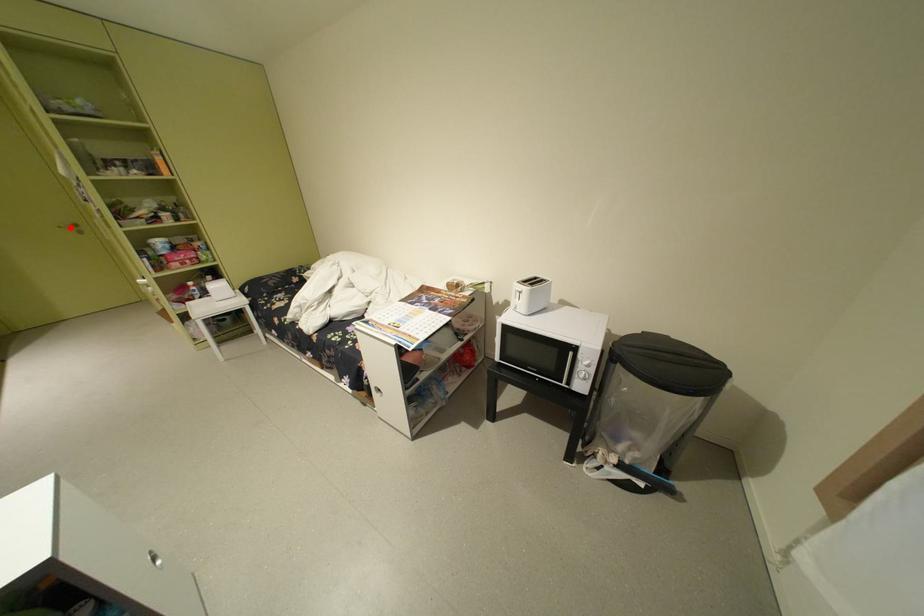
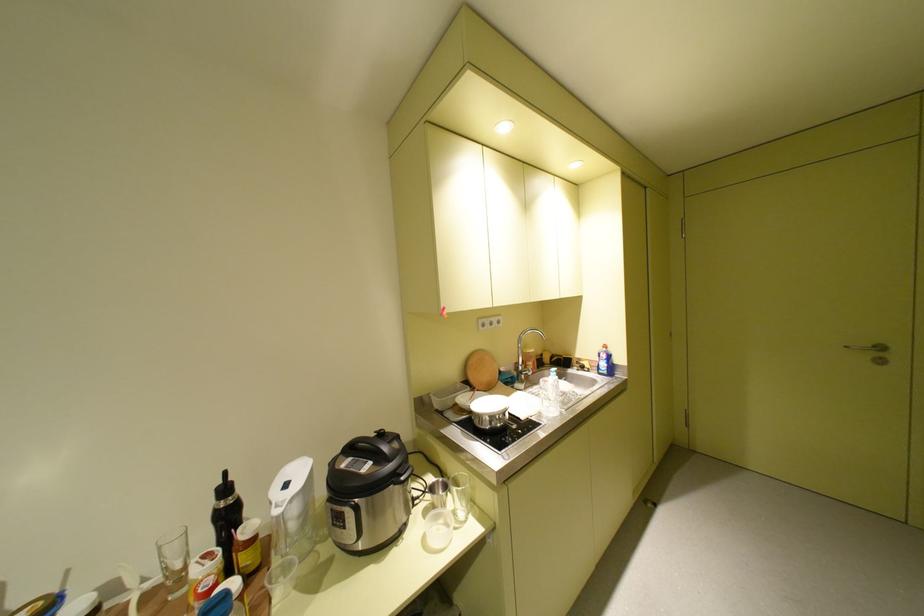
In the second image, find the point that corresponds to the highlighted location in the first image.

(857, 347)